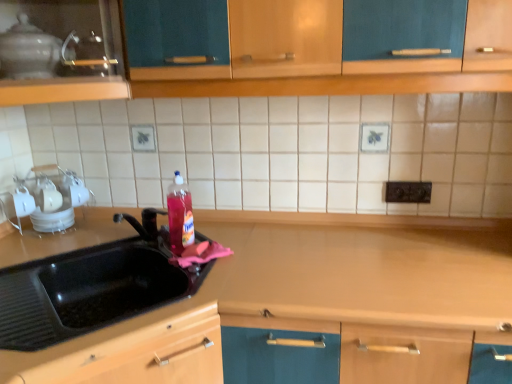
This screenshot has width=512, height=384. Identify the location of free point above wooden counter at center (from a real-world perspective). (380, 268).